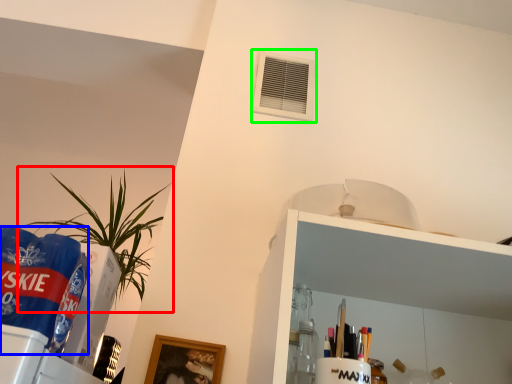
Question: Estimate the real-world distances between objects in this image. Which object is farther from houseplant (highlighted by a red box), beverage (highlighted by a blue box) or air conditioning (highlighted by a green box)?

Choices:
 (A) beverage
 (B) air conditioning

Answer: (A)